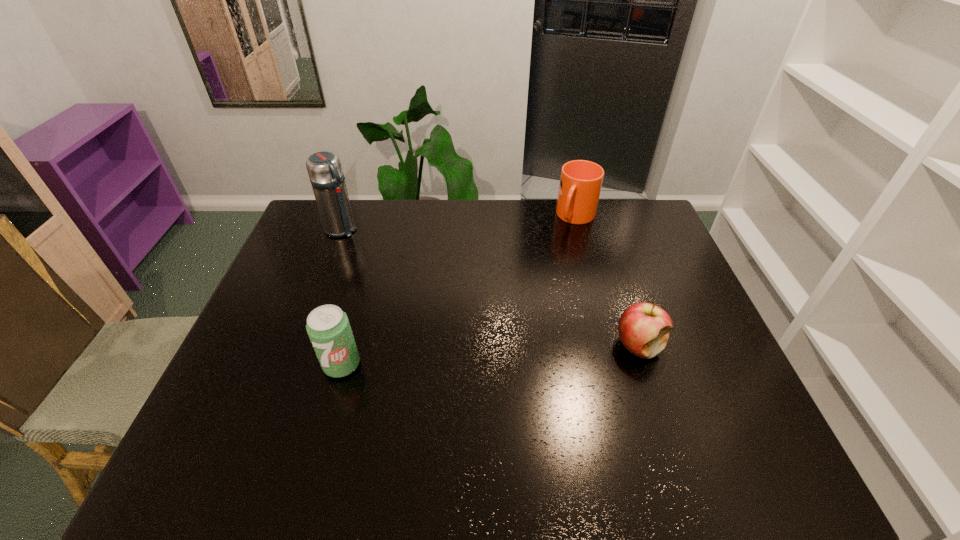
The height and width of the screenshot is (540, 960). Find the location of `vacant spot on the desktop that is between the soda and the shortest object and is positioned on the handle side of the mug`. vacant spot on the desktop that is between the soda and the shortest object and is positioned on the handle side of the mug is located at coordinates (506, 354).

This screenshot has width=960, height=540. In order to click on vacant space on the desktop that is between the soda and the shortest object and is positioned with a handle on the side of the thermos bottle in this screenshot , I will do `click(494, 355)`.